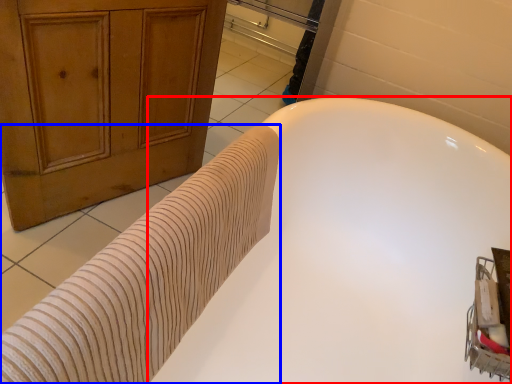
Question: Which point is closer to the camera, bathtub (highlighted by a red box) or bath towel (highlighted by a blue box)?

Choices:
 (A) bathtub
 (B) bath towel

Answer: (A)